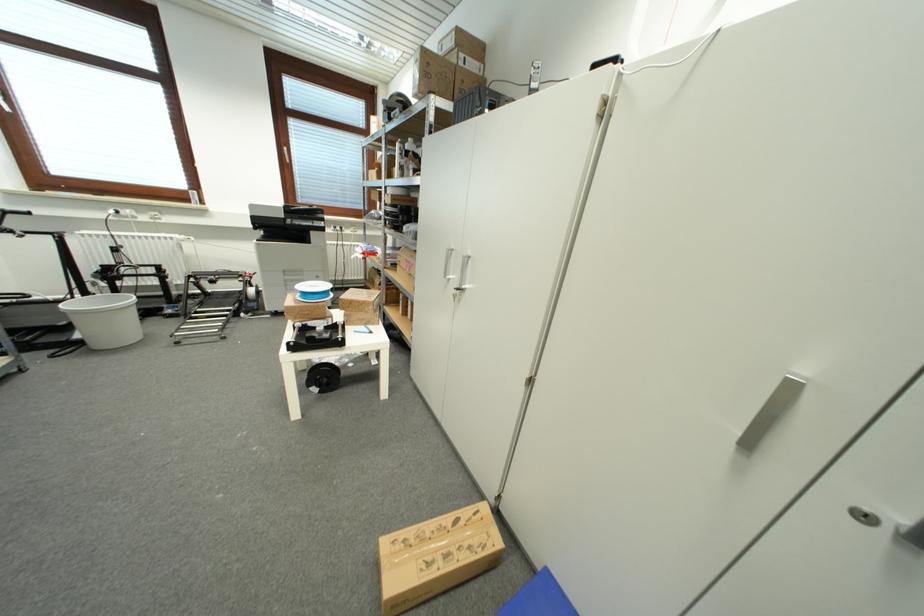
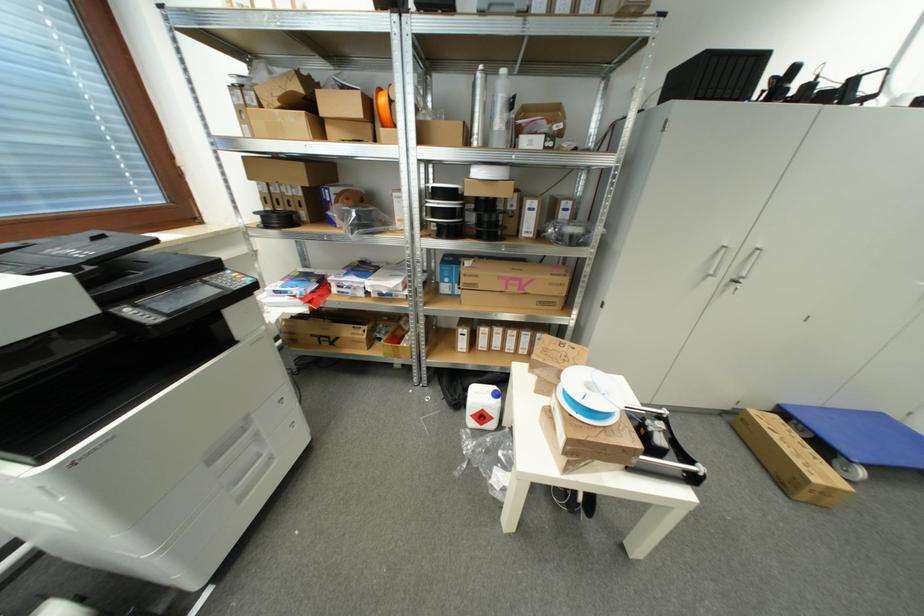
The point at (x=411, y=272) is marked in the first image. Where is the corresponding point in the second image?

(517, 292)